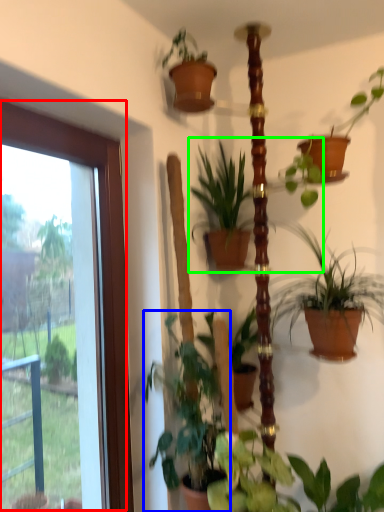
Question: Based on their relative distances, which object is farther from window (highlighted by a red box)? Choose from houseplant (highlighted by a blue box) and houseplant (highlighted by a green box).

Choices:
 (A) houseplant
 (B) houseplant

Answer: (B)